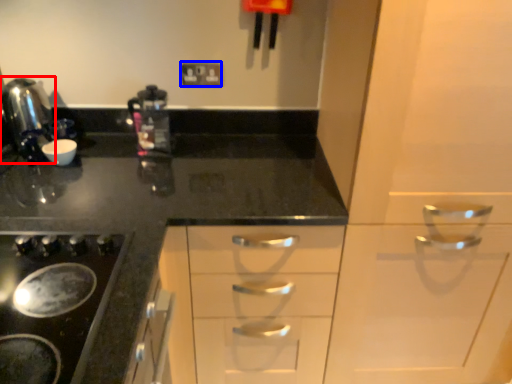
Question: Which object appears farthest to the camera in this image, kitchen appliance (highlighted by a red box) or electric outlet (highlighted by a blue box)?

Choices:
 (A) kitchen appliance
 (B) electric outlet

Answer: (B)